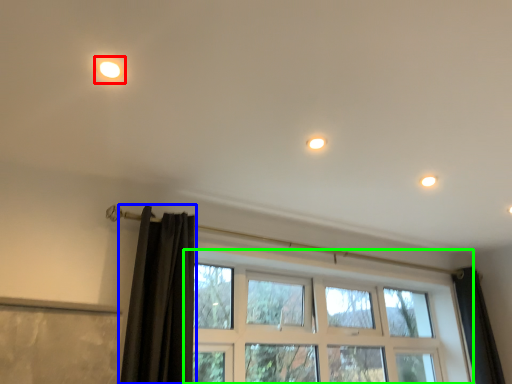
Question: Considering the real-world distances, which object is farthest from light (highlighted by a red box)? curtain (highlighted by a blue box) or window (highlighted by a green box)?

Choices:
 (A) curtain
 (B) window

Answer: (B)